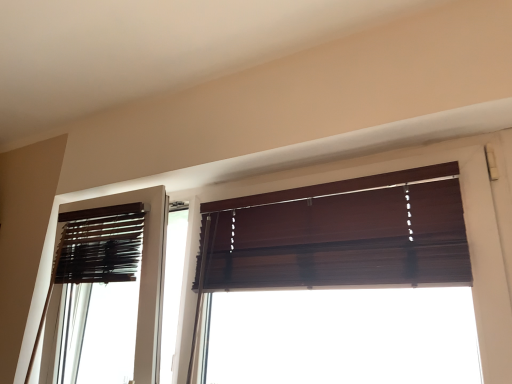
What do you see at coordinates (337, 235) in the screenshot? I see `dark wood blinds at upper center` at bounding box center [337, 235].

Locate an element on the screen. This screenshot has width=512, height=384. dark wood blinds at upper center is located at coordinates (337, 235).

In the scene shown: Measure the distance between dark wood blinds at upper center and camera.

They are 37.09 inches apart.

This screenshot has width=512, height=384. I want to click on brown matte blinds at left, so click(x=143, y=273).

What do you see at coordinates (143, 273) in the screenshot? I see `brown matte blinds at left` at bounding box center [143, 273].

Locate an element on the screen. The width and height of the screenshot is (512, 384). dark wood blinds at upper center is located at coordinates (337, 235).

Considering the relative positions of dark wood blinds at upper center and brown matte blinds at left in the image provided, is dark wood blinds at upper center to the left of brown matte blinds at left from the viewer's perspective?

No.

Between dark wood blinds at upper center and brown matte blinds at left, which one is positioned behind?

brown matte blinds at left.

Is point (279, 195) positioned after point (115, 198)?

No, (279, 195) is closer to viewer.

From the image's perspective, relative to brown matte blinds at left, is dark wood blinds at upper center above or below?

From the image's perspective, dark wood blinds at upper center appears above brown matte blinds at left.

From a real-world perspective, is dark wood blinds at upper center located beneath brown matte blinds at left?

No, from a real-world perspective, dark wood blinds at upper center is not beneath brown matte blinds at left.

Can you confirm if dark wood blinds at upper center is wider than brown matte blinds at left?

No, dark wood blinds at upper center is not wider than brown matte blinds at left.

Which of these two, dark wood blinds at upper center or brown matte blinds at left, stands shorter?

brown matte blinds at left.

From the picture: Can you confirm if dark wood blinds at upper center is bigger than brown matte blinds at left?

Yes.

Is dark wood blinds at upper center not within brown matte blinds at left?

Absolutely, dark wood blinds at upper center is external to brown matte blinds at left.

Is there a large distance between dark wood blinds at upper center and brown matte blinds at left?

They are positioned close to each other.

Is dark wood blinds at upper center oriented away from brown matte blinds at left?

dark wood blinds at upper center does not have its back to brown matte blinds at left.

Can you tell me how much dark wood blinds at upper center and brown matte blinds at left differ in facing direction?

The angular difference between dark wood blinds at upper center and brown matte blinds at left is 9.76 degrees.

Find the location of a particular element. window located in front of the brown matte blinds at left is located at coordinates (337, 235).

Which object is positioned more to the left, brown matte blinds at left or dark wood blinds at upper center?

brown matte blinds at left.

From the picture: Is brown matte blinds at left further to camera compared to dark wood blinds at upper center?

That is True.

Between point (163, 234) and point (228, 225), which one is positioned in front?

Positioned in front is point (163, 234).

From the image's perspective, is brown matte blinds at left located above or below dark wood blinds at upper center?

Based on their image positions, brown matte blinds at left is located beneath dark wood blinds at upper center.

From a real-world perspective, is brown matte blinds at left physically located above or below dark wood blinds at upper center?

Clearly, from a real-world perspective, brown matte blinds at left is below dark wood blinds at upper center.

Does brown matte blinds at left have a lesser width compared to dark wood blinds at upper center?

Incorrect, the width of brown matte blinds at left is not less than that of dark wood blinds at upper center.

Who is taller, brown matte blinds at left or dark wood blinds at upper center?

dark wood blinds at upper center.

From the picture: Who is bigger, brown matte blinds at left or dark wood blinds at upper center?

With larger size is dark wood blinds at upper center.

Is brown matte blinds at left not within dark wood blinds at upper center?

Absolutely, brown matte blinds at left is external to dark wood blinds at upper center.

Are brown matte blinds at left and dark wood blinds at upper center far apart?

No.

Is brown matte blinds at left facing towards dark wood blinds at upper center?

No, brown matte blinds at left is not oriented towards dark wood blinds at upper center.

What's the angular difference between brown matte blinds at left and dark wood blinds at upper center's facing directions?

brown matte blinds at left and dark wood blinds at upper center are facing 9.76 degrees away from each other.

Where is `window on the right of brown matte blinds at left`? This screenshot has width=512, height=384. window on the right of brown matte blinds at left is located at coordinates tap(337, 235).

Locate an element on the screen. The image size is (512, 384). window above the brown matte blinds at left (from a real-world perspective) is located at coordinates (337, 235).

Find the location of a particular element. The image size is (512, 384). window located on the right of brown matte blinds at left is located at coordinates (337, 235).